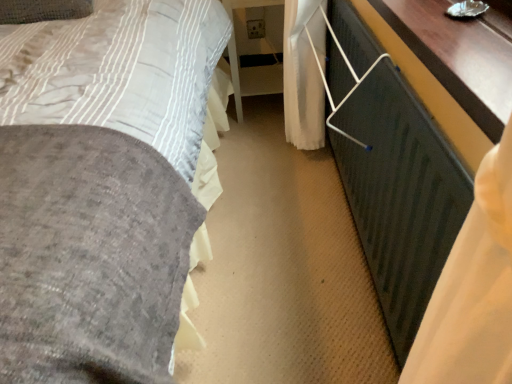
Where is `free point below metallic silver balustrade at lower right (from a real-world perspective)`? The width and height of the screenshot is (512, 384). free point below metallic silver balustrade at lower right (from a real-world perspective) is located at coordinates (353, 246).